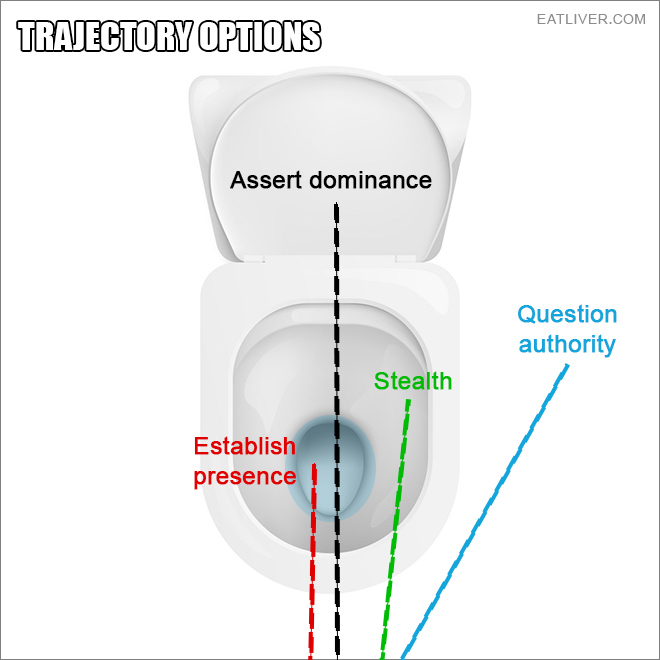
This screenshot has width=660, height=660. In order to click on seat in this screenshot , I will do `click(222, 327)`.